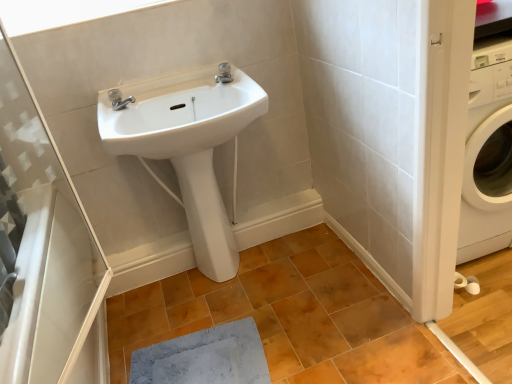
Question: Considering the relative positions of white matte window at upper left and brown matte tile at center in the image provided, is white matte window at upper left to the right of brown matte tile at center from the viewer's perspective?

Choices:
 (A) yes
 (B) no

Answer: (B)

Question: Is white matte window at upper left bigger than brown matte tile at center?

Choices:
 (A) yes
 (B) no

Answer: (B)

Question: Is white matte window at upper left not inside brown matte tile at center?

Choices:
 (A) yes
 (B) no

Answer: (A)

Question: Can you confirm if white matte window at upper left is positioned to the left of brown matte tile at center?

Choices:
 (A) yes
 (B) no

Answer: (A)

Question: Is white matte window at upper left positioned with its back to brown matte tile at center?

Choices:
 (A) no
 (B) yes

Answer: (A)

Question: From the image's perspective, is white matte window at upper left on brown matte tile at center?

Choices:
 (A) yes
 (B) no

Answer: (A)

Question: From the image's perspective, is blue soft mat at lower center located above white glossy sink at upper center?

Choices:
 (A) no
 (B) yes

Answer: (A)

Question: Can you confirm if blue soft mat at lower center is wider than white glossy sink at upper center?

Choices:
 (A) no
 (B) yes

Answer: (B)

Question: From a real-world perspective, is blue soft mat at lower center below white glossy sink at upper center?

Choices:
 (A) no
 (B) yes

Answer: (B)

Question: From a real-world perspective, is blue soft mat at lower center over white glossy sink at upper center?

Choices:
 (A) yes
 (B) no

Answer: (B)

Question: Does blue soft mat at lower center turn towards white glossy sink at upper center?

Choices:
 (A) no
 (B) yes

Answer: (A)

Question: Is blue soft mat at lower center at the left side of white glossy sink at upper center?

Choices:
 (A) yes
 (B) no

Answer: (B)

Question: From the image's perspective, is white matte window at upper left under transparent plastic shower door at left?

Choices:
 (A) no
 (B) yes

Answer: (A)